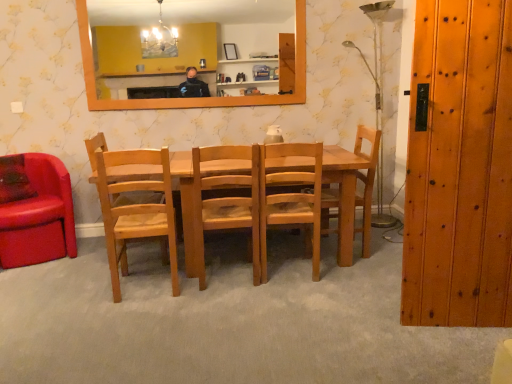
Identify the location of free space on the front side of wooden chair at center, the third chair from the right. This screenshot has width=512, height=384. (225, 302).